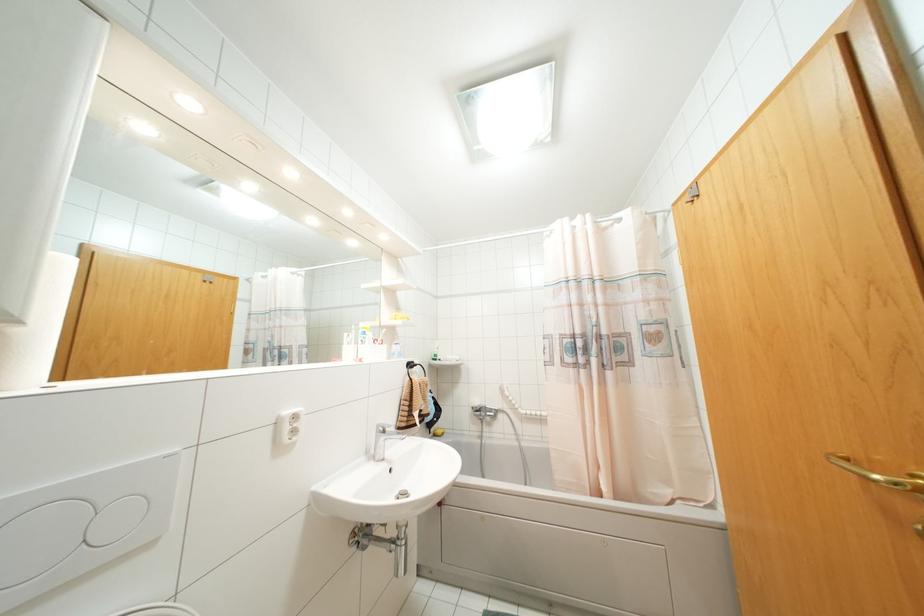
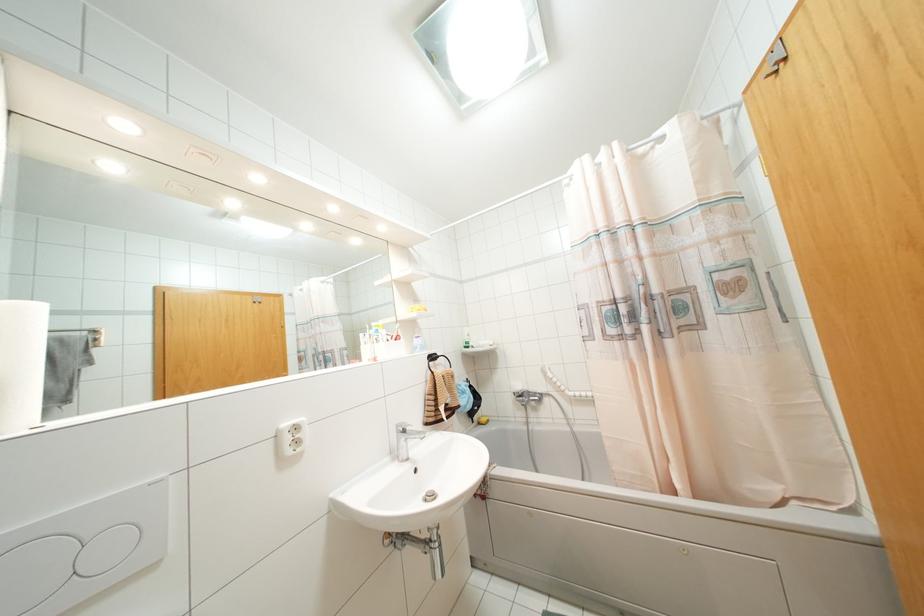
Locate, in the second image, the point that corresponds to [295,416] in the first image.

(296, 428)